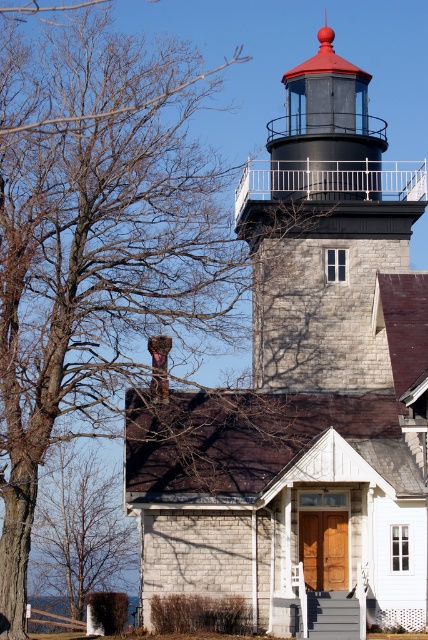
Between dark gray stone lighthouse at center and brown bark tree at lower left, which one has less height?

brown bark tree at lower left is shorter.

Is the position of dark gray stone lighthouse at center less distant than that of brown bark tree at lower left?

Yes, dark gray stone lighthouse at center is closer to the viewer.

Between point (326, 92) and point (44, 480), which one is positioned in front?

Point (326, 92)

Where is `dark gray stone lighthouse at center`? dark gray stone lighthouse at center is located at coordinates (323, 230).